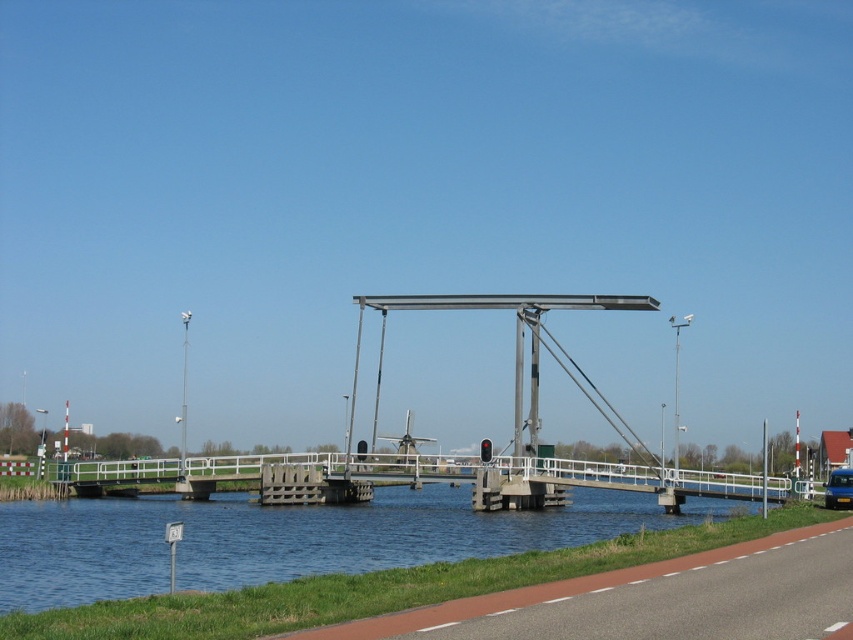
Question: Considering the relative positions of blue water at lower left and blue metallic van at center in the image provided, where is blue water at lower left located with respect to blue metallic van at center?

Choices:
 (A) below
 (B) above

Answer: (A)

Question: Is blue water at lower left above blue metallic van at center?

Choices:
 (A) yes
 (B) no

Answer: (B)

Question: Which point is farther from the camera taking this photo?

Choices:
 (A) (506, 552)
 (B) (830, 483)

Answer: (B)

Question: Which point is farther from the camera taking this photo?

Choices:
 (A) (364, 529)
 (B) (850, 488)

Answer: (B)

Question: Can you confirm if blue water at lower left is smaller than blue metallic van at center?

Choices:
 (A) no
 (B) yes

Answer: (A)